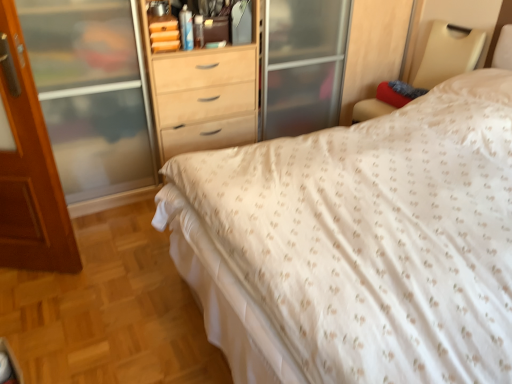
Where is `unoccupied space behind brown wooden door at left`? unoccupied space behind brown wooden door at left is located at coordinates click(96, 226).